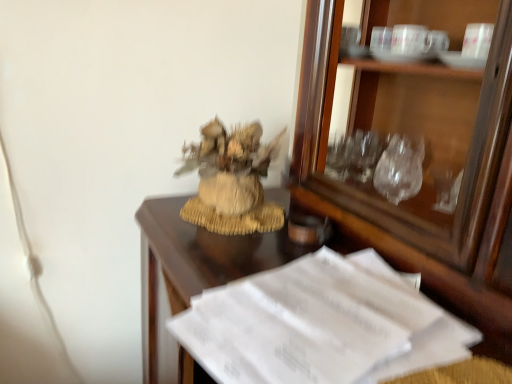
Identify the location of burlap textured houseplant at center. Image resolution: width=512 pixels, height=384 pixels. (231, 180).

At what (x,y) coordinates should I click in order to perform the action: click on burlap textured houseplant at center. Please return your answer as a coordinate pair (x, y). Looking at the image, I should click on (231, 180).

In the image, there is a burlap textured houseplant at center. Where is `desk below it (from a real-world perspective)`? The height and width of the screenshot is (384, 512). desk below it (from a real-world perspective) is located at coordinates (186, 277).

Is white paper at lower right at the back of burlap textured houseplant at center?

No, burlap textured houseplant at center is not facing the opposite direction of white paper at lower right.

In the scene shown: Is white paper at lower right surrounded by burlap textured houseplant at center?

Actually, white paper at lower right is outside burlap textured houseplant at center.

From the image's perspective, would you say burlap textured houseplant at center is shown under white paper at lower right?

Actually, burlap textured houseplant at center appears above white paper at lower right in the image.

From the picture: Considering the relative sizes of matte brown glass at center and burlap textured houseplant at center in the image provided, is matte brown glass at center bigger than burlap textured houseplant at center?

Incorrect, matte brown glass at center is not larger than burlap textured houseplant at center.

In the scene shown: From the image's perspective, which is below, matte brown glass at center or burlap textured houseplant at center?

matte brown glass at center.

Considering the sizes of objects matte brown glass at center and burlap textured houseplant at center in the image provided, who is wider, matte brown glass at center or burlap textured houseplant at center?

Wider between the two is burlap textured houseplant at center.

Would you say burlap textured houseplant at center is part of white paper at lower right's contents?

No, burlap textured houseplant at center is located outside of white paper at lower right.

What's the angular difference between white paper at lower right and burlap textured houseplant at center's facing directions?

The angle between the facing direction of white paper at lower right and the facing direction of burlap textured houseplant at center is 2.51 degrees.

Considering the sizes of objects white paper at lower right and burlap textured houseplant at center in the image provided, who is shorter, white paper at lower right or burlap textured houseplant at center?

Standing shorter between the two is white paper at lower right.

Between white paper at lower right and burlap textured houseplant at center, which one has larger size?

With larger size is burlap textured houseplant at center.

Is white paper at lower right located outside matte brown glass at center?

Indeed, white paper at lower right is completely outside matte brown glass at center.

From the image's perspective, is white paper at lower right above matte brown glass at center?

No.

From a real-world perspective, between white paper at lower right and matte brown glass at center, who is vertically higher?

From a 3D spatial view, matte brown glass at center is above.

Considering the relative sizes of white paper at lower right and matte brown glass at center in the image provided, is white paper at lower right taller than matte brown glass at center?

Yes, white paper at lower right is taller than matte brown glass at center.

From the image's perspective, is matte brown glass at center located above or below white paper at lower right?

Clearly, from the image's perspective, matte brown glass at center is above white paper at lower right.

Is point (319, 232) closer or farther from the camera than point (206, 277)?

Point (319, 232).

From a real-world perspective, is matte brown glass at center positioned above or below white paper at lower right?

matte brown glass at center is situated higher than white paper at lower right in the real world.

Which is more distant, [237,183] or [298,219]?

The point [298,219] is behind.

Is matte brown glass at center inside burlap textured houseplant at center?

No, matte brown glass at center is not surrounded by burlap textured houseplant at center.

Considering the relative sizes of burlap textured houseplant at center and matte brown glass at center in the image provided, is burlap textured houseplant at center taller than matte brown glass at center?

Yes.

From the image's perspective, is burlap textured houseplant at center above matte brown glass at center?

Yes, from the image's perspective, burlap textured houseplant at center is on top of matte brown glass at center.

At what (x,y) coordinates should I click in order to perform the action: click on houseplant to the left of white paper at lower right. Please return your answer as a coordinate pair (x, y). Looking at the image, I should click on (231, 180).

The height and width of the screenshot is (384, 512). Identify the location of houseplant in front of the matte brown glass at center. (231, 180).

From the image, which object appears to be farther from white paper at lower right, matte brown glass at center or burlap textured houseplant at center?

matte brown glass at center is further to white paper at lower right.

In the scene shown: Based on their spatial positions, is white paper at lower right or matte brown glass at center further from burlap textured houseplant at center?

Among the two, matte brown glass at center is located further to burlap textured houseplant at center.

Which object lies nearer to the anchor point burlap textured houseplant at center, matte brown glass at center or white paper at lower right?

white paper at lower right lies closer to burlap textured houseplant at center than the other object.

Looking at the image, which one is located closer to matte brown glass at center, burlap textured houseplant at center or white paper at lower right?

Among the two, burlap textured houseplant at center is located nearer to matte brown glass at center.

When comparing their distances from white paper at lower right, does burlap textured houseplant at center or matte brown glass at center seem closer?

burlap textured houseplant at center.

From the image, which object appears to be nearer to matte brown glass at center, white paper at lower right or burlap textured houseplant at center?

burlap textured houseplant at center lies closer to matte brown glass at center than the other object.

I want to click on houseplant between white paper at lower right and matte brown glass at center along the z-axis, so point(231,180).